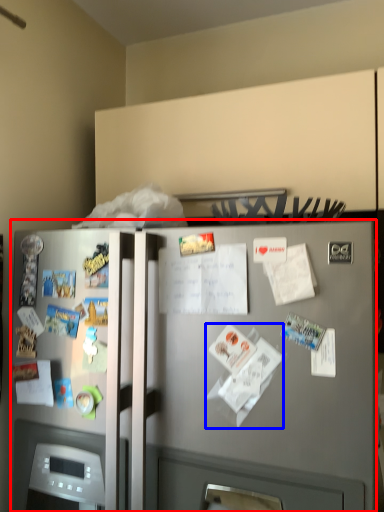
Question: Which point is closer to the camera, refrigerator (highlighted by a red box) or paper (highlighted by a blue box)?

Choices:
 (A) refrigerator
 (B) paper

Answer: (A)